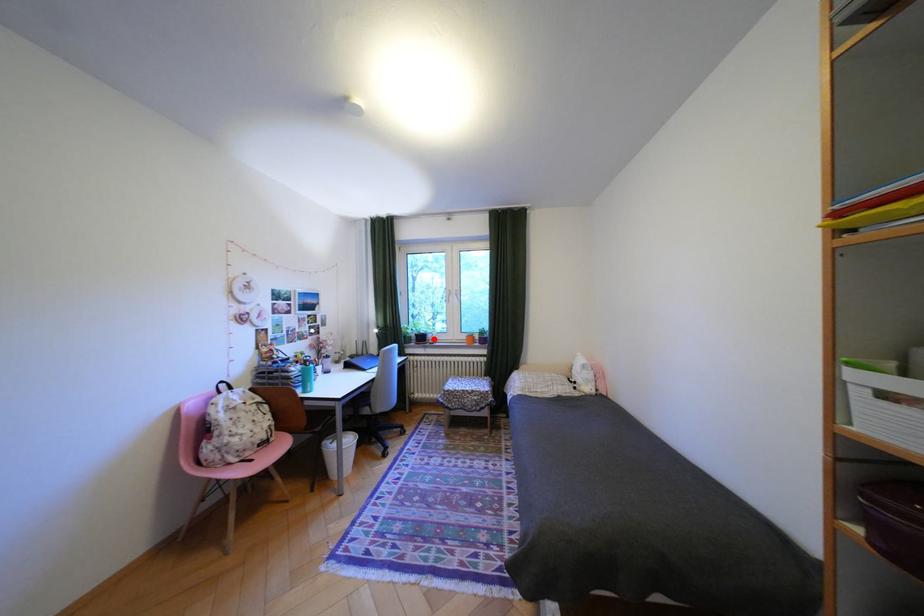
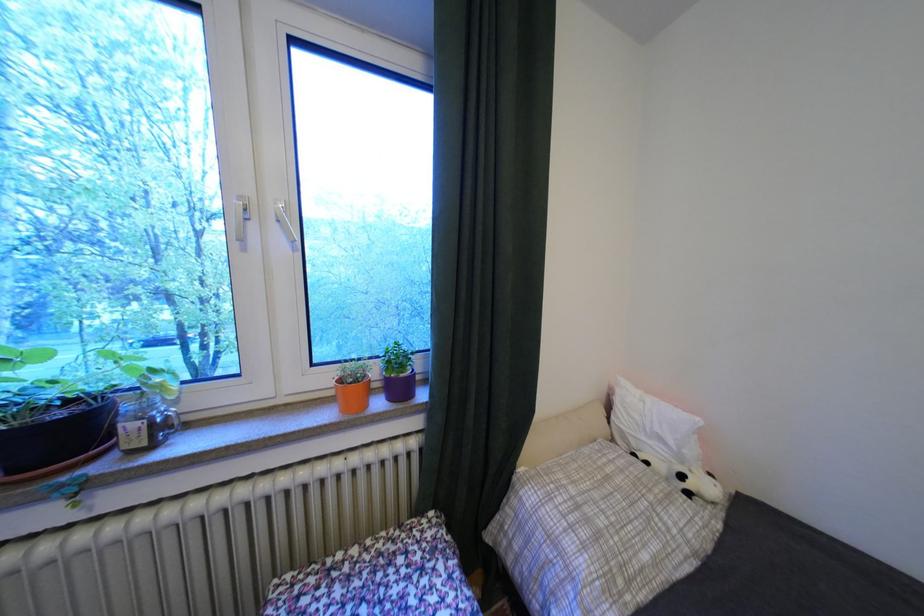
The point at the highlighted location is marked in the first image. Where is the corresponding point in the second image?

(75, 436)